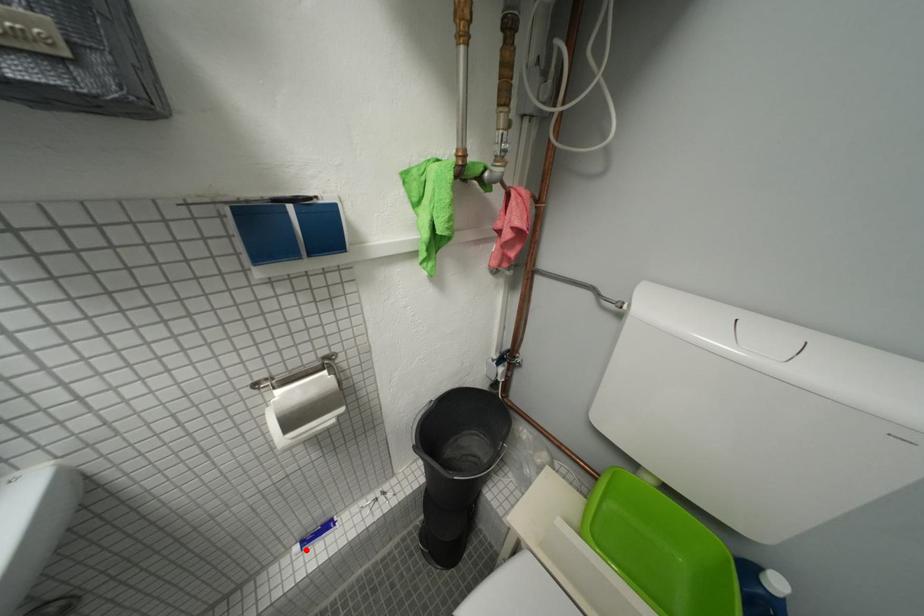
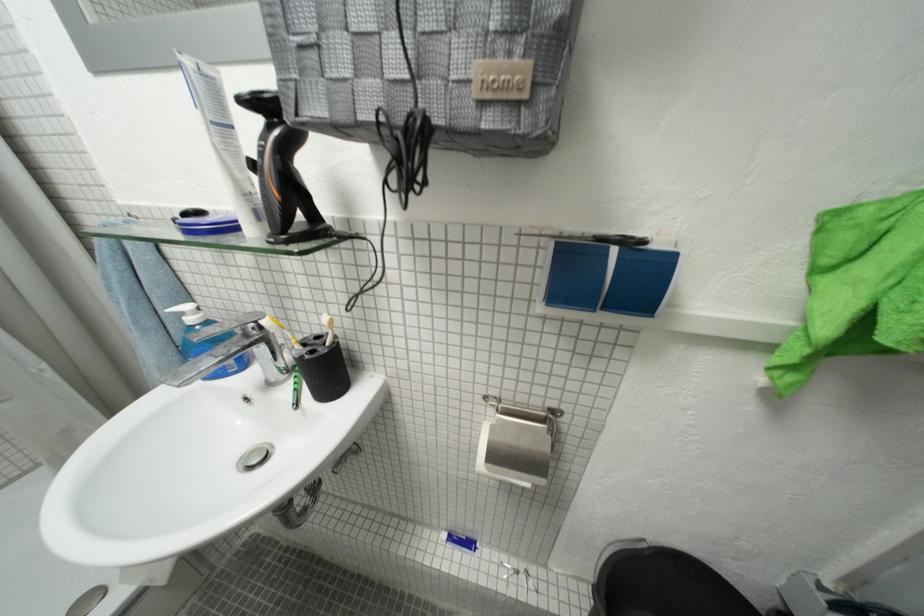
The point at the highlighted location is marked in the first image. Where is the corresponding point in the second image?

(454, 538)